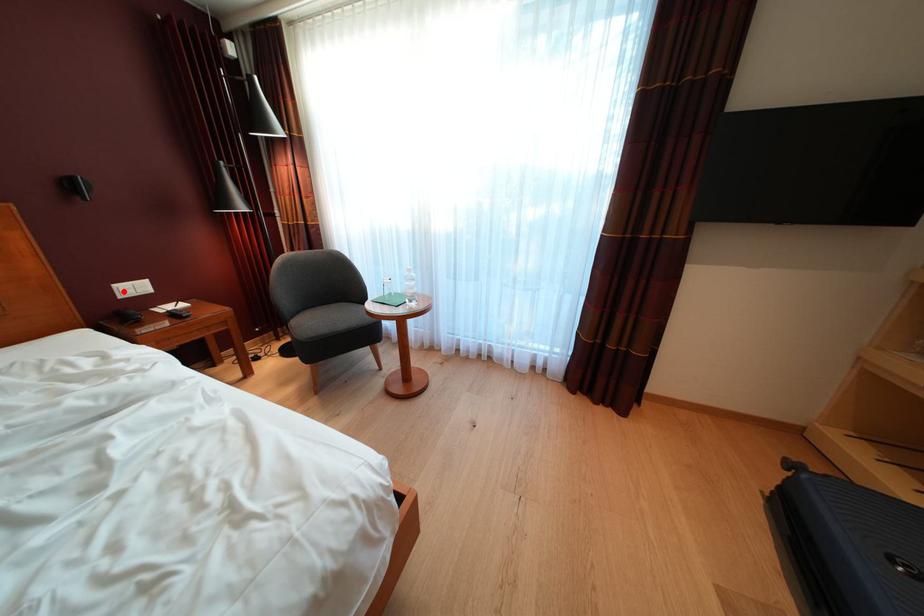
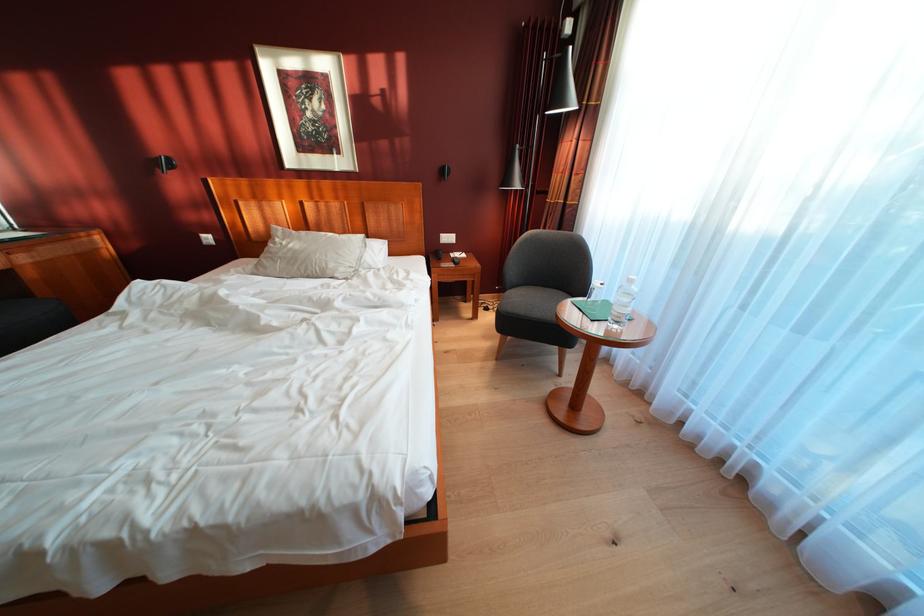
In the second image, find the point that corresponds to the highlighted location in the first image.

(450, 241)